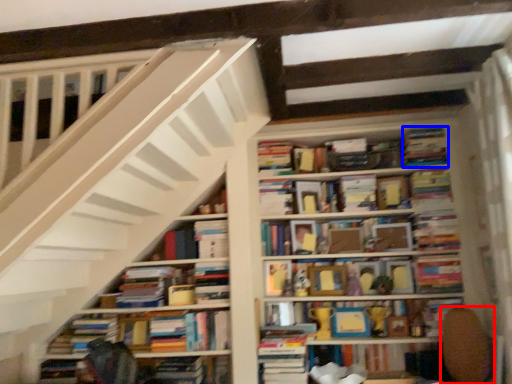
Question: Which point is closer to the camera, swivel chair (highlighted by a red box) or book (highlighted by a blue box)?

Choices:
 (A) swivel chair
 (B) book

Answer: (A)